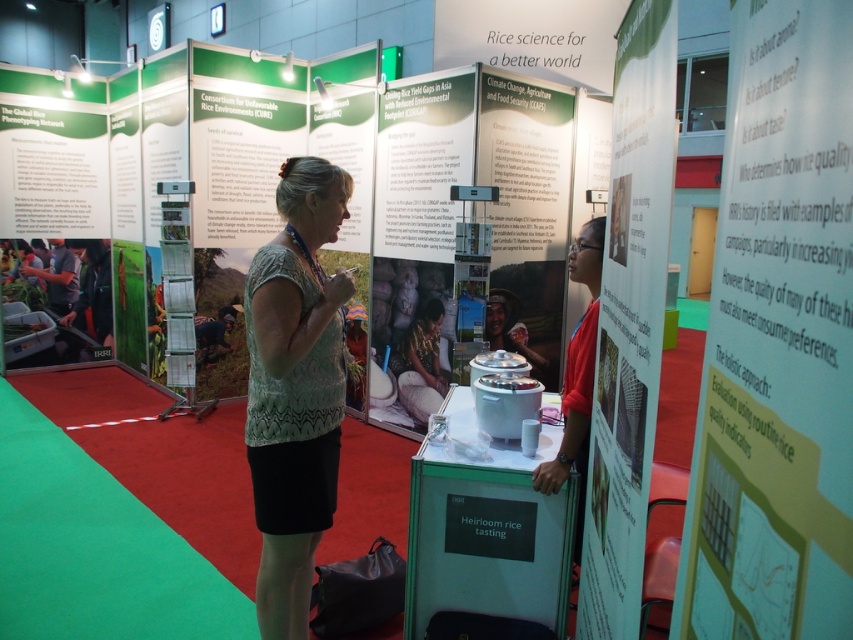
You are a visitor at the exhibition and want to read the text on the white paper at upper right and the green textured blouse at center. Which object is shorter and thus easier to reach without standing on tiptoes?

The white paper at upper right is shorter than the green textured blouse at center, so it is easier to reach without standing on tiptoes.

You are attending a rice science conference and notice two items in the display booth. The first is a white paper at upper right, and the second is a green textured blouse at center. Based on their positions, which item is located farther to the east?

The white paper at upper right is located farther to the east because it is positioned to the right of the green textured blouse at center, and in the image, right typically corresponds to east in such layouts.

You are a photographer setting up for a presentation at the rice science conference. You need to ensure that all elements in the photo are in focus. The camera you are using has a depth of field that can sharply capture objects within 45 centimeters from the camera. Is the white paper at upper right within the camera focus range?

The white paper at upper right is 46.28 centimeters away from the camera, which is slightly beyond the 45 centimeter depth of field range. Therefore, it may not be in sharp focus.